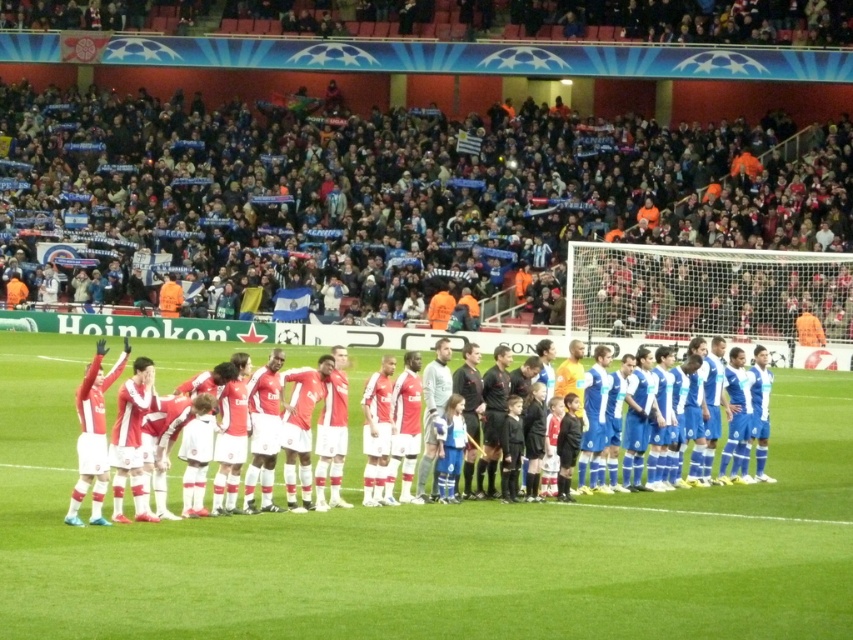
Between dark blue fabric crowd at upper center and matte red jersey at center, which one appears on the right side from the viewer's perspective?

From the viewer's perspective, matte red jersey at center appears more on the right side.

Can you confirm if dark blue fabric crowd at upper center is smaller than matte red jersey at center?

No.

Find the location of `dark blue fabric crowd at upper center`. dark blue fabric crowd at upper center is located at coordinates (387, 196).